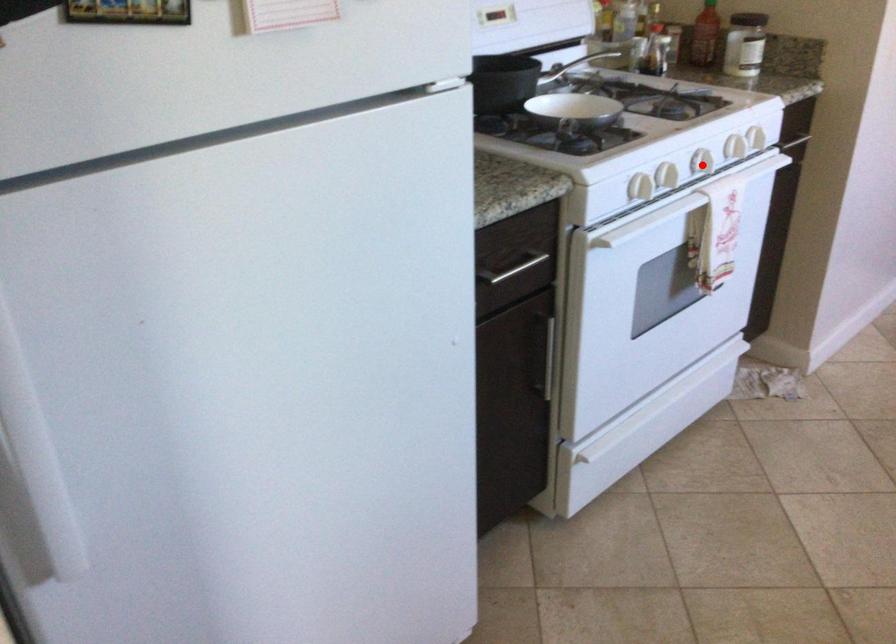
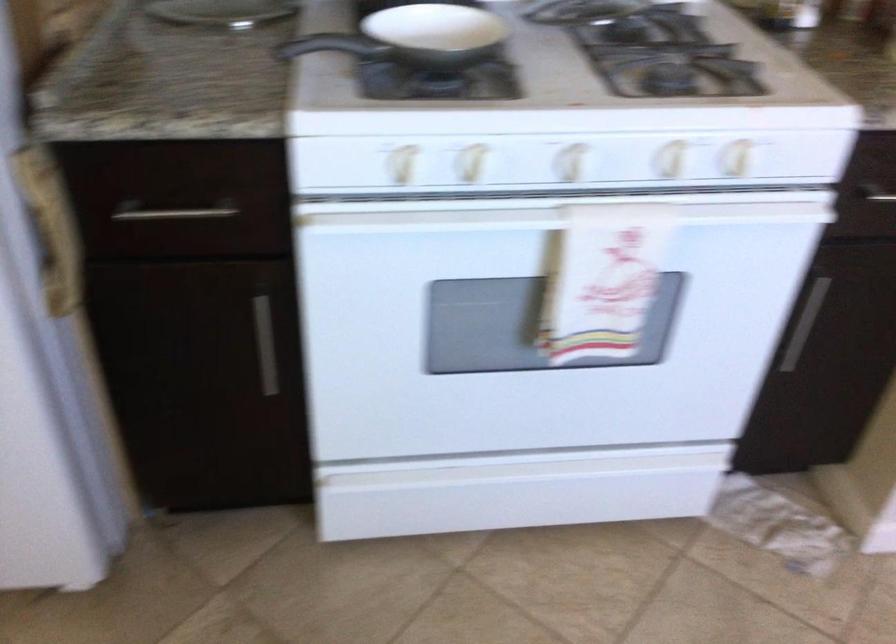
Question: I am providing you with two images of the same scene from different viewpoints. Given a red point in image1, look at the same physical point in image2. Is it:

Choices:
 (A) Closer to the viewpoint
 (B) Farther from the viewpoint

Answer: (A)